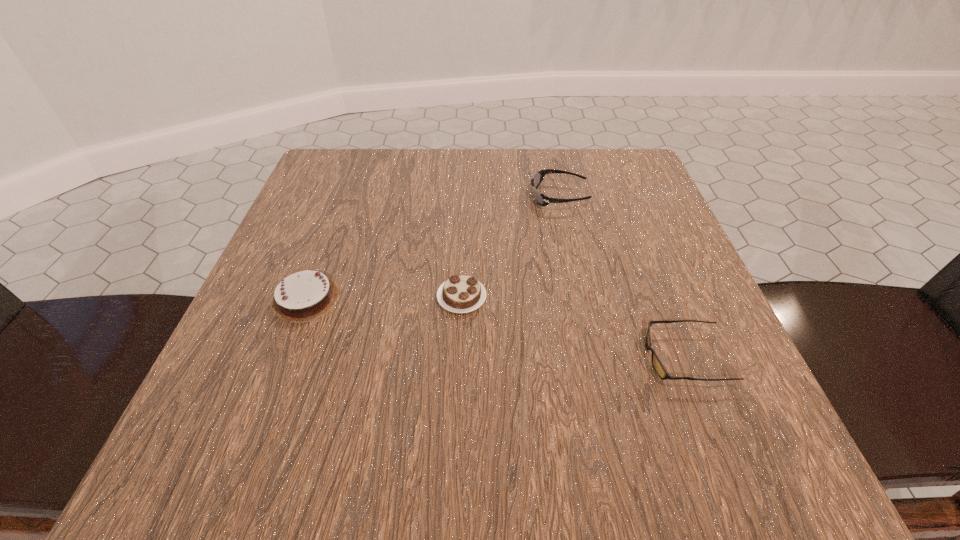
This screenshot has height=540, width=960. I want to click on the left sunglasses, so click(542, 200).

Find the location of a particular element. the farthest object is located at coordinates (x=542, y=200).

You are a GUI agent. You are given a task and a screenshot of the screen. Output one action in this format:
    pyautogui.click(x=<x>, y=<y>)
    Task: Click on the rightmost object
    
    Given the screenshot: What is the action you would take?
    pyautogui.click(x=656, y=362)

This screenshot has height=540, width=960. What are the coordinates of `the shorter sunglasses` in the screenshot? It's located at (656, 362).

The height and width of the screenshot is (540, 960). Find the location of `the left chocolate cake`. the left chocolate cake is located at coordinates (306, 295).

Locate an element on the screen. Image resolution: width=960 pixels, height=540 pixels. the right chocolate cake is located at coordinates (460, 294).

This screenshot has height=540, width=960. In order to click on vacant space positioned on the lenses of the farthest object in this screenshot , I will do `click(444, 197)`.

In order to click on vacant space located on the lenses of the farthest object in this screenshot , I will do `click(473, 197)`.

Identify the location of vacant space located 0.300m on the lenses of the farthest object. This screenshot has width=960, height=540. (387, 197).

At what (x,y) coordinates should I click in order to perform the action: click on vacant space located 0.200m on the front-facing side of the shorter sunglasses. Please return your answer as a coordinate pair (x, y). This screenshot has height=540, width=960. Looking at the image, I should click on (508, 357).